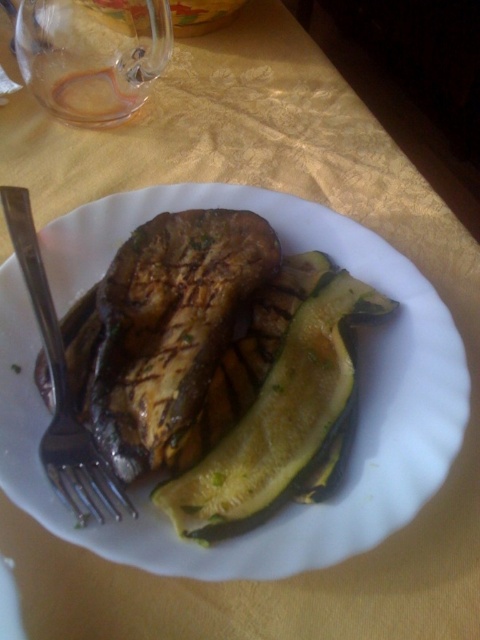
Question: Which object is farther from the camera taking this photo?

Choices:
 (A) grilled brown steak at center
 (B) silver metallic fork at lower left

Answer: (A)

Question: Which object is positioned closest to the green smooth zucchini at center?

Choices:
 (A) grilled brown steak at center
 (B) slightly charred eggplant at center
 (C) silver metallic fork at lower left

Answer: (A)

Question: Can you confirm if slightly charred eggplant at center is positioned to the left of green smooth zucchini at center?

Choices:
 (A) no
 (B) yes

Answer: (B)

Question: Is slightly charred eggplant at center smaller than green smooth zucchini at center?

Choices:
 (A) no
 (B) yes

Answer: (A)

Question: Which of these objects is positioned farthest from the silver metallic fork at lower left?

Choices:
 (A) slightly charred eggplant at center
 (B) grilled brown steak at center
 (C) green smooth zucchini at center

Answer: (C)

Question: From the image, what is the correct spatial relationship of green smooth zucchini at center in relation to silver metallic fork at lower left?

Choices:
 (A) above
 (B) below

Answer: (B)